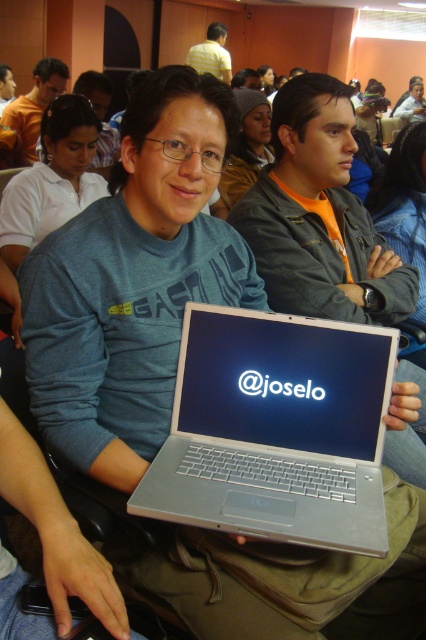
You are a photographer trying to capture a clear photo of both the silver metallic laptop at center and the matte gray jacket at center. Since you can only focus on one object at a time, which one should you focus on to ensure the other remains in the background?

You should focus on the silver metallic laptop at center because it is closer to the viewer than the matte gray jacket at center, so focusing on it will keep the matte gray jacket at center in the background.

You are organizing a photo shoot and need to ensure that the yellow shirt at upper center and the matte black laptop at center are both visible in the frame. Based on their sizes, which object will require more horizontal space to fully capture in the photo?

The yellow shirt at upper center requires more horizontal space because its width surpasses that of the matte black laptop at center.

You are standing in the conference room and want to determine which of the two points, point (213, 500) or point (385, 280), is nearer to you. Based on the scene, which point is closer?

Point (213, 500) is closer to the camera than point (385, 280), so it is the nearer one.